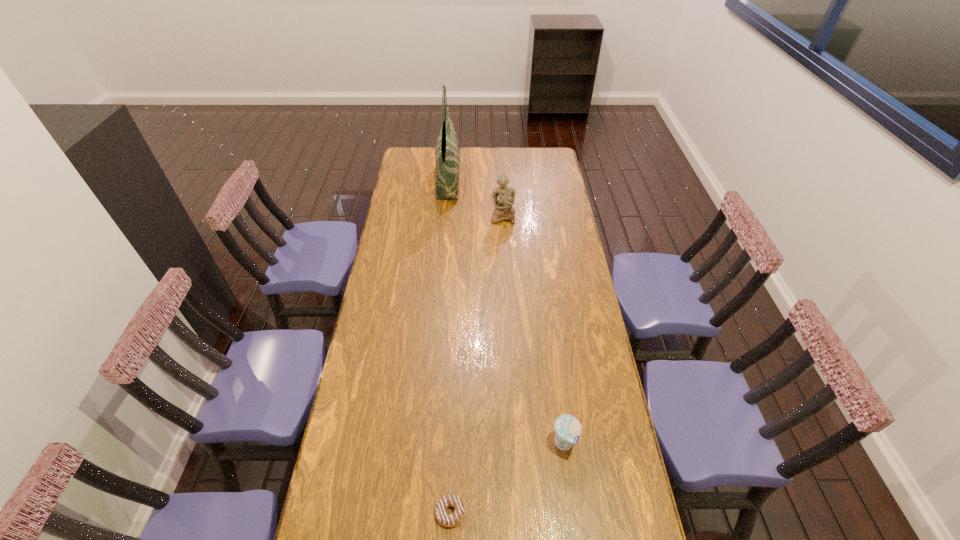
Where is `free space that satisfies the following two spatial constraints: 1. on the front side of the third tallest object; 2. on the left side of the farthest object`? The image size is (960, 540). free space that satisfies the following two spatial constraints: 1. on the front side of the third tallest object; 2. on the left side of the farthest object is located at coordinates (424, 444).

Locate an element on the screen. The width and height of the screenshot is (960, 540). blank space that satisfies the following two spatial constraints: 1. on the front-facing side of the rightmost object; 2. on the left side of the third nearest object is located at coordinates (516, 444).